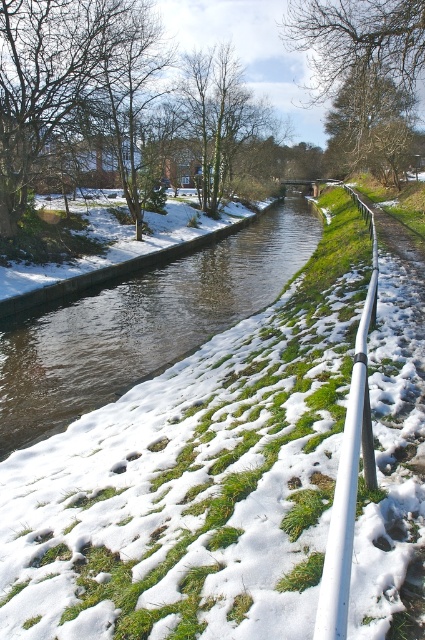
Is point (11, 413) positioned behind point (351, 67)?

No, (11, 413) is in front of (351, 67).

Is point (261, 307) behind point (306, 45)?

No, it is not.

Find the location of a particular element. smooth concrete canal at center is located at coordinates (141, 323).

Between brown leafless tree at upper center and white metallic rail at right, which one is positioned lower?

white metallic rail at right is lower down.

Who is more forward, (328,28) or (345,468)?

Point (345,468) is more forward.

Locate an element on the screen. Image resolution: width=425 pixels, height=640 pixels. brown leafless tree at upper center is located at coordinates (357, 38).

Locate an element on the screen. brown leafless tree at upper center is located at coordinates (357, 38).

From the picture: Does smooth concrete canal at center appear under white metallic rail at right?

No, smooth concrete canal at center is not below white metallic rail at right.

Is point (102, 289) less distant than point (354, 352)?

That is False.

Find the location of a particular element. Image resolution: width=425 pixels, height=640 pixels. smooth concrete canal at center is located at coordinates (141, 323).